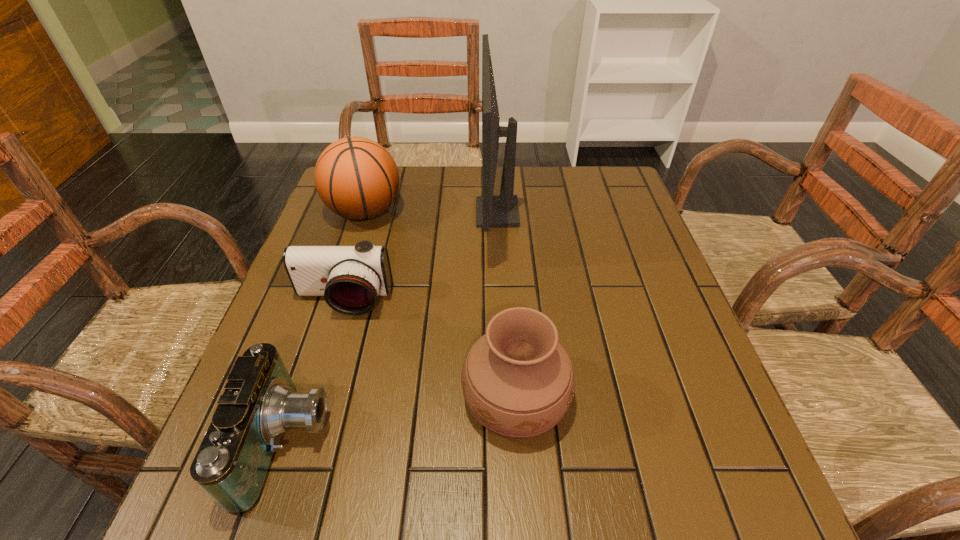
Where is `free space between the tallest object and the third farthest object`? The width and height of the screenshot is (960, 540). free space between the tallest object and the third farthest object is located at coordinates (420, 257).

Locate an element on the screen. The height and width of the screenshot is (540, 960). vacant space in between the farther camcorder and the computer monitor is located at coordinates (420, 257).

Locate which object is the fourth closest to the farther camcorder. Please provide its 2D coordinates. Your answer should be formatted as a tuple, i.e. [(x, y)], where the tuple contains the x and y coordinates of a point satisfying the conditions above.

[(502, 211)]

The image size is (960, 540). I want to click on object identified as the fourth closest to the basketball, so click(x=260, y=403).

Locate an element on the screen. Image resolution: width=960 pixels, height=540 pixels. free region that satisfies the following two spatial constraints: 1. on the front-facing side of the urn; 2. on the left side of the tallest object is located at coordinates (506, 396).

Locate an element on the screen. This screenshot has width=960, height=540. vacant space that satisfies the following two spatial constraints: 1. on the front side of the basketball; 2. on the front-facing side of the nearer camcorder is located at coordinates [292, 441].

The height and width of the screenshot is (540, 960). I want to click on blank area in the image that satisfies the following two spatial constraints: 1. on the front-facing side of the computer monitor; 2. on the right side of the urn, so click(506, 396).

Locate an element on the screen. This screenshot has width=960, height=540. vacant position in the image that satisfies the following two spatial constraints: 1. on the surface of the third farthest object; 2. on the front-facing side of the nearer camcorder is located at coordinates (300, 441).

Find the location of a particular element. Image resolution: width=960 pixels, height=540 pixels. vacant point that satisfies the following two spatial constraints: 1. on the surface of the third nearest object; 2. on the front-facing side of the nearer camcorder is located at coordinates (300, 441).